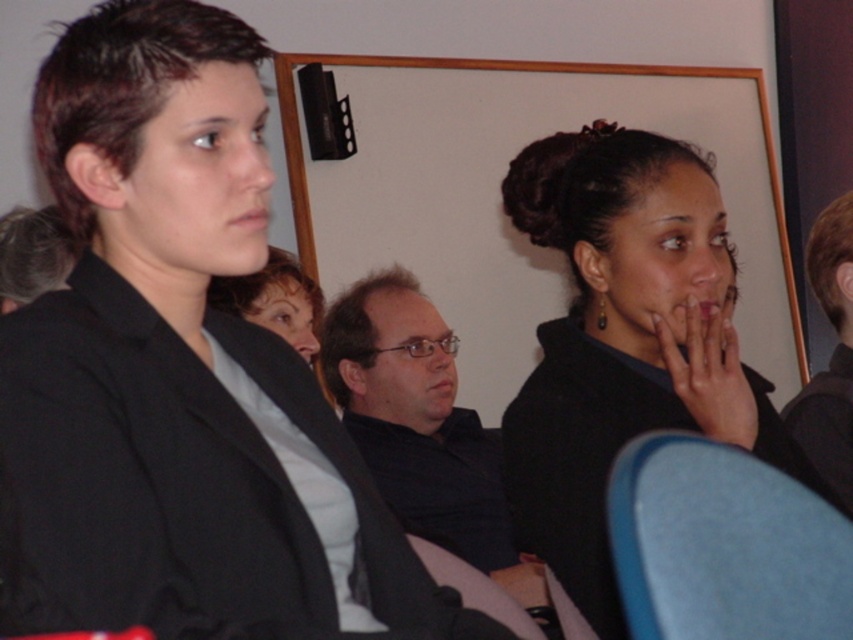
Does black matte blazer at left lie behind dark blue shirt at center?

No.

Locate an element on the screen. black matte blazer at left is located at coordinates (180, 484).

Between point (444, 332) and point (732, 406), which one is positioned behind?

The point (444, 332) is more distant.

Can you confirm if dark blue shirt at center is smaller than smooth skin hand at center right?

No, dark blue shirt at center is not smaller than smooth skin hand at center right.

Locate an element on the screen. dark blue shirt at center is located at coordinates (422, 429).

Is dark brown hair at upper right to the left of smooth skin hand at center right from the viewer's perspective?

Incorrect, dark brown hair at upper right is not on the left side of smooth skin hand at center right.

Is dark brown hair at upper right smaller than smooth skin hand at center right?

No, dark brown hair at upper right is not smaller than smooth skin hand at center right.

Find the location of a particular element. Image resolution: width=853 pixels, height=640 pixels. dark brown hair at upper right is located at coordinates (831, 355).